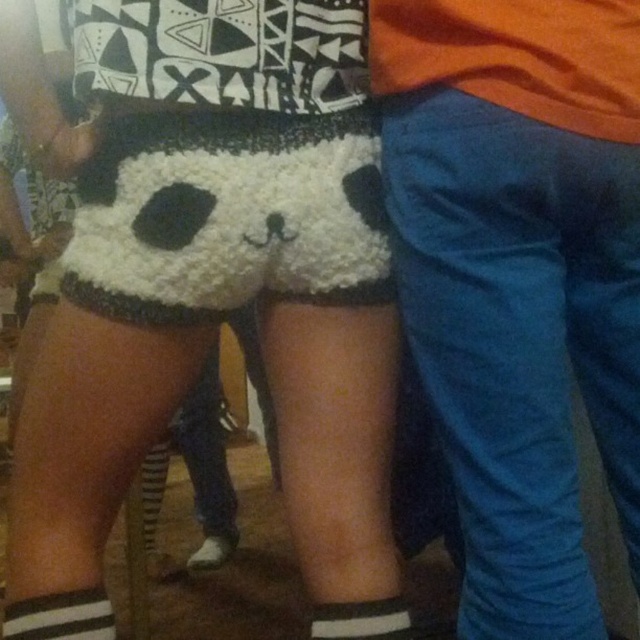
Question: Is white fuzzy shorts at center positioned in front of white striped sock at lower left?

Choices:
 (A) yes
 (B) no

Answer: (A)

Question: Which point is farther to the camera?

Choices:
 (A) white striped sock at lower left
 (B) white fuzzy shorts at center
 (C) white knit sock at lower center

Answer: (C)

Question: Which object is positioned farthest from the white fluffy shorts at center?

Choices:
 (A) white fuzzy shorts at center
 (B) white knit sock at lower center

Answer: (B)

Question: Is white fluffy shorts at center wider than white knit sock at lower center?

Choices:
 (A) yes
 (B) no

Answer: (A)

Question: Which point is closer to the camera?

Choices:
 (A) white striped sock at lower left
 (B) white fluffy shorts at center
 (C) white knit sock at lower center

Answer: (B)

Question: Does white fuzzy shorts at center appear on the right side of white striped sock at lower left?

Choices:
 (A) no
 (B) yes

Answer: (B)